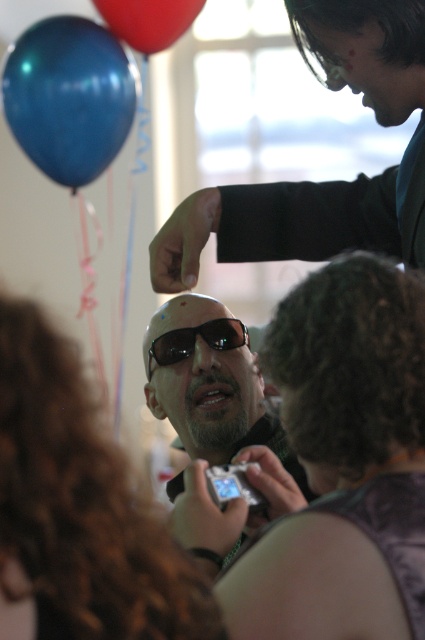
You are standing in the scene and want to hand the shiny black sunglasses at upper center to someone. If you walk straight ahead, will you be able to reach the sunglasses without moving them?

The shiny black sunglasses at upper center and viewer are 1.06 meters apart from each other, so you would need to walk about 1.06 meters forward to reach them.

You are a photographer standing at the center of the scene. You want to take a photo that includes both the shiny black sunglasses at upper center and the shiny red balloon at upper left. Given that your camera has a maximum focus range of 30 inches, will you be able to capture both objects in focus?

The shiny black sunglasses at upper center is 34.19 inches away from the shiny red balloon at upper left. Since the distance between them exceeds the camera maximum focus range of 30 inches, you cannot capture both objects in focus.